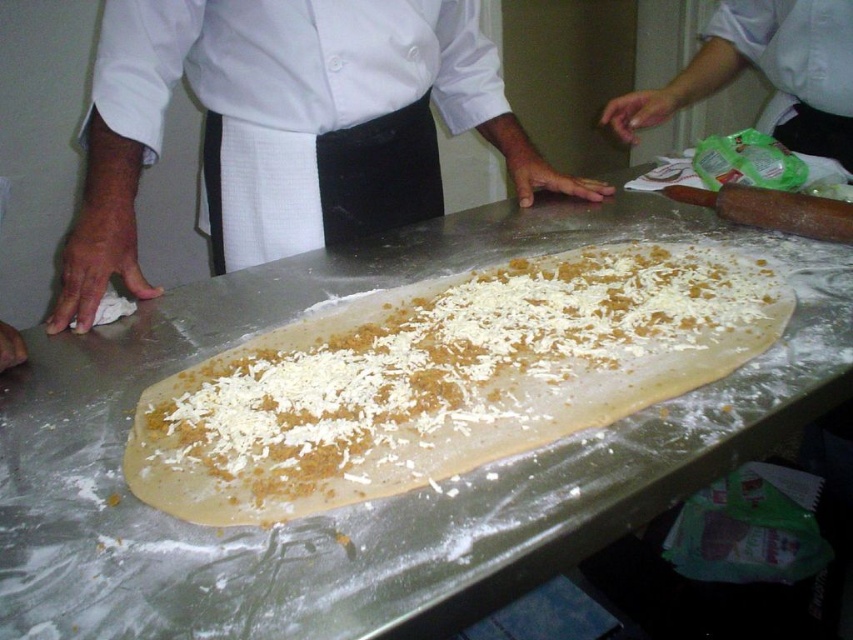
Is white crumbly dough at center bigger than wooden rolling pin at right?

Indeed, white crumbly dough at center has a larger size compared to wooden rolling pin at right.

Does white crumbly dough at center come in front of wooden rolling pin at right?

Yes.

Based on the photo, who is more distant from viewer, (x=511, y=360) or (x=813, y=220)?

Positioned behind is point (x=813, y=220).

Identify the location of white crumbly dough at center. This screenshot has width=853, height=640. (445, 378).

Is white fabric apron at center above wooden rolling pin at right?

Correct, white fabric apron at center is located above wooden rolling pin at right.

Who is higher up, white fabric apron at center or wooden rolling pin at right?

white fabric apron at center

The width and height of the screenshot is (853, 640). In order to click on white fabric apron at center in this screenshot , I will do `click(315, 184)`.

Which of these two, white cloth at left or wooden rolling pin at right, stands taller?

white cloth at left is taller.

Is white cloth at left below wooden rolling pin at right?

Actually, white cloth at left is above wooden rolling pin at right.

Identify the location of white cloth at left. The height and width of the screenshot is (640, 853). (271, 115).

I want to click on white cloth at left, so click(x=271, y=115).